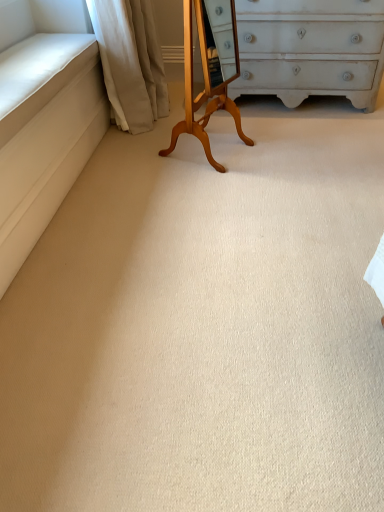
Find the location of a particular element. This screenshot has height=512, width=384. beige fabric curtain at upper left is located at coordinates (130, 62).

Describe the element at coordinates (130, 62) in the screenshot. I see `beige fabric curtain at upper left` at that location.

This screenshot has width=384, height=512. What are the coordinates of `light brown wood changing table at center` in the screenshot? It's located at (210, 70).

What is the approximate width of light brown wood changing table at center?

16.84 inches.

This screenshot has width=384, height=512. What do you see at coordinates (210, 70) in the screenshot?
I see `light brown wood changing table at center` at bounding box center [210, 70].

This screenshot has width=384, height=512. I want to click on beige fabric curtain at upper left, so click(x=130, y=62).

Is light brown wood changing table at center at the right side of beige fabric curtain at upper left?

Indeed, light brown wood changing table at center is positioned on the right side of beige fabric curtain at upper left.

Based on the photo, is light brown wood changing table at center in front of or behind beige fabric curtain at upper left in the image?

Visually, light brown wood changing table at center is located in front of beige fabric curtain at upper left.

Between point (198, 106) and point (132, 70), which one is positioned in front?

Point (198, 106)

From the image's perspective, does light brown wood changing table at center appear lower than beige fabric curtain at upper left?

Indeed, from the image's perspective, light brown wood changing table at center is shown beneath beige fabric curtain at upper left.

From a real-world perspective, which is physically below, light brown wood changing table at center or beige fabric curtain at upper left?

beige fabric curtain at upper left, from a real-world perspective.

Consider the image. Considering the sizes of objects light brown wood changing table at center and beige fabric curtain at upper left in the image provided, who is thinner, light brown wood changing table at center or beige fabric curtain at upper left?

Thinner between the two is light brown wood changing table at center.

In terms of height, does light brown wood changing table at center look taller or shorter compared to beige fabric curtain at upper left?

light brown wood changing table at center is taller than beige fabric curtain at upper left.

Does light brown wood changing table at center have a smaller size compared to beige fabric curtain at upper left?

Yes, light brown wood changing table at center is smaller than beige fabric curtain at upper left.

Is beige fabric curtain at upper left completely or partially inside light brown wood changing table at center?

Definitely not — beige fabric curtain at upper left is not inside light brown wood changing table at center.

Is light brown wood changing table at center beside beige fabric curtain at upper left?

light brown wood changing table at center is not next to beige fabric curtain at upper left, and they're not touching.

Is light brown wood changing table at center aimed at beige fabric curtain at upper left?

No, light brown wood changing table at center does not turn towards beige fabric curtain at upper left.

How different are the orientations of light brown wood changing table at center and beige fabric curtain at upper left in degrees?

light brown wood changing table at center and beige fabric curtain at upper left are facing 64.4 degrees away from each other.

This screenshot has height=512, width=384. In order to click on changing table lying below the beige fabric curtain at upper left (from the image's perspective) in this screenshot , I will do `click(210, 70)`.

Would you say beige fabric curtain at upper left is to the left or to the right of light brown wood changing table at center in the picture?

Based on their positions, beige fabric curtain at upper left is located to the left of light brown wood changing table at center.

Between beige fabric curtain at upper left and light brown wood changing table at center, which one is positioned in front?

light brown wood changing table at center is closer to the camera.

Between point (122, 128) and point (203, 17), which one is positioned behind?

The point (122, 128) is more distant.

From the image's perspective, which one is positioned higher, beige fabric curtain at upper left or light brown wood changing table at center?

beige fabric curtain at upper left.

From a real-world perspective, which is physically below, beige fabric curtain at upper left or light brown wood changing table at center?

From a 3D spatial view, beige fabric curtain at upper left is below.

Considering the sizes of objects beige fabric curtain at upper left and light brown wood changing table at center in the image provided, who is thinner, beige fabric curtain at upper left or light brown wood changing table at center?

light brown wood changing table at center is thinner.

Does beige fabric curtain at upper left have a lesser height compared to light brown wood changing table at center?

Yes, beige fabric curtain at upper left is shorter than light brown wood changing table at center.

Consider the image. Based on their sizes in the image, would you say beige fabric curtain at upper left is bigger or smaller than light brown wood changing table at center?

In the image, beige fabric curtain at upper left appears to be larger than light brown wood changing table at center.

Would you say beige fabric curtain at upper left is outside light brown wood changing table at center?

Yes.

Is beige fabric curtain at upper left far from light brown wood changing table at center?

beige fabric curtain at upper left is near light brown wood changing table at center, not far away.

Is beige fabric curtain at upper left positioned with its back to light brown wood changing table at center?

That's not correct — beige fabric curtain at upper left is not looking away from light brown wood changing table at center.

How different are the orientations of beige fabric curtain at upper left and light brown wood changing table at center in degrees?

There is a 64.4-degree angle between the facing directions of beige fabric curtain at upper left and light brown wood changing table at center.

Identify the location of changing table on the right of beige fabric curtain at upper left. This screenshot has width=384, height=512. (210, 70).

Identify the location of changing table on the right of beige fabric curtain at upper left. The width and height of the screenshot is (384, 512). pyautogui.click(x=210, y=70).

Locate an element on the screen. curtain below the light brown wood changing table at center (from a real-world perspective) is located at coordinates click(130, 62).